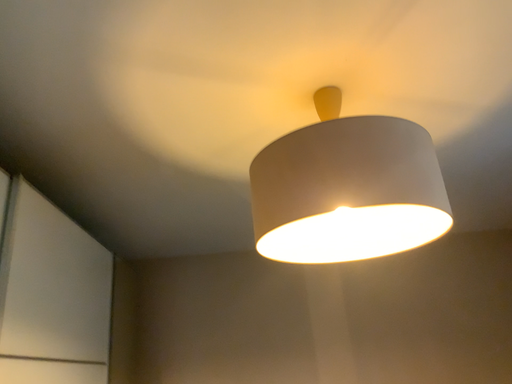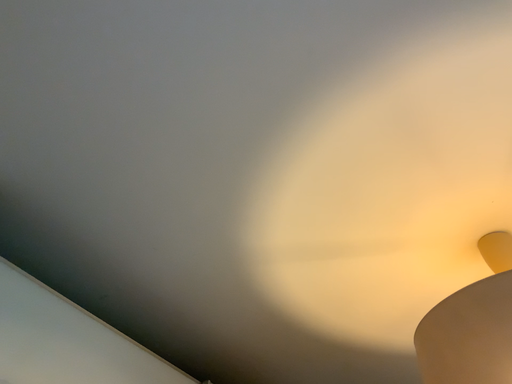
Question: Which way did the camera rotate in the video?

Choices:
 (A) rotated left
 (B) rotated right

Answer: (A)